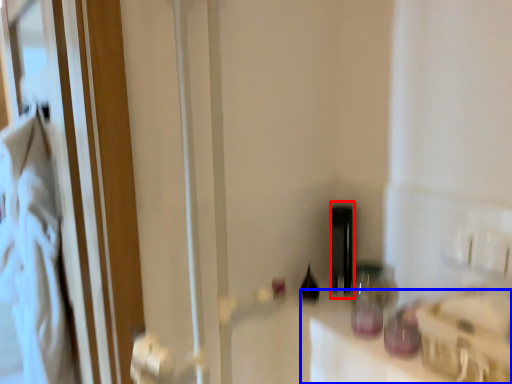
Question: Which object is further to the camera taking this photo, bottle (highlighted by a red box) or counter top (highlighted by a blue box)?

Choices:
 (A) bottle
 (B) counter top

Answer: (A)